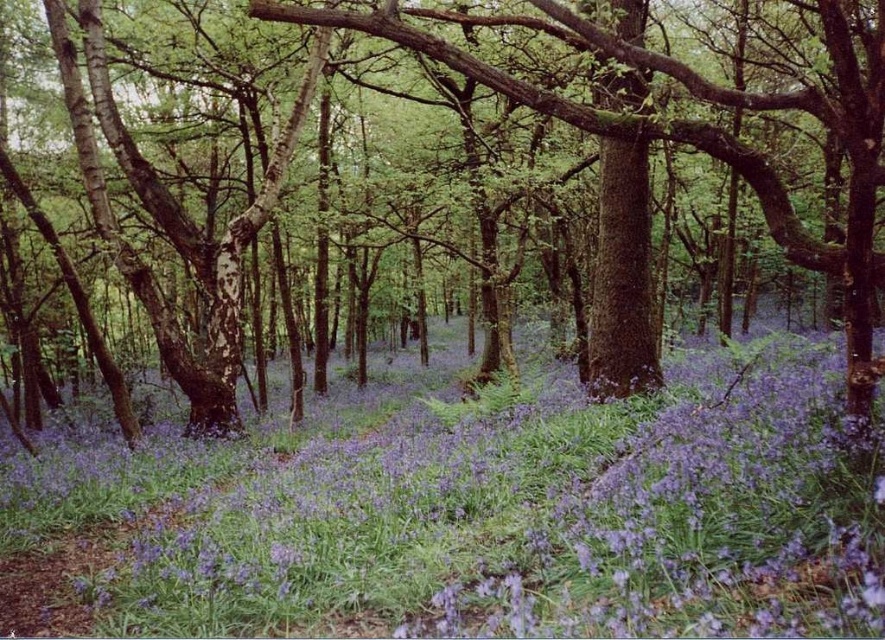
Between point (660, 508) and point (137, 168), which one is positioned behind?

Positioned behind is point (137, 168).

Can you confirm if purple matte flower at center is positioned above green matte tree at center?

No, purple matte flower at center is not above green matte tree at center.

Between point (137, 541) and point (139, 260), which one is positioned behind?

The point (139, 260) is behind.

Find the location of `purple matte flower at center`. purple matte flower at center is located at coordinates (471, 513).